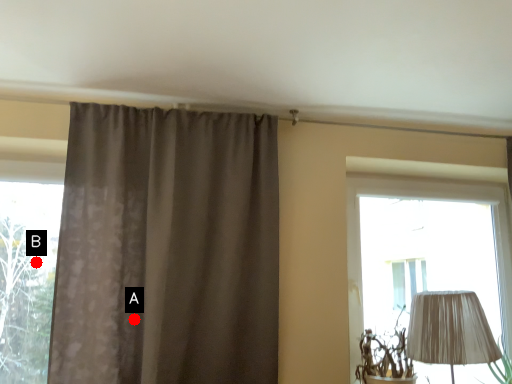
Question: Two points are circled on the image, labeled by A and B beside each circle. Which point appears closest to the camera in this image?

Choices:
 (A) A is closer
 (B) B is closer

Answer: (A)